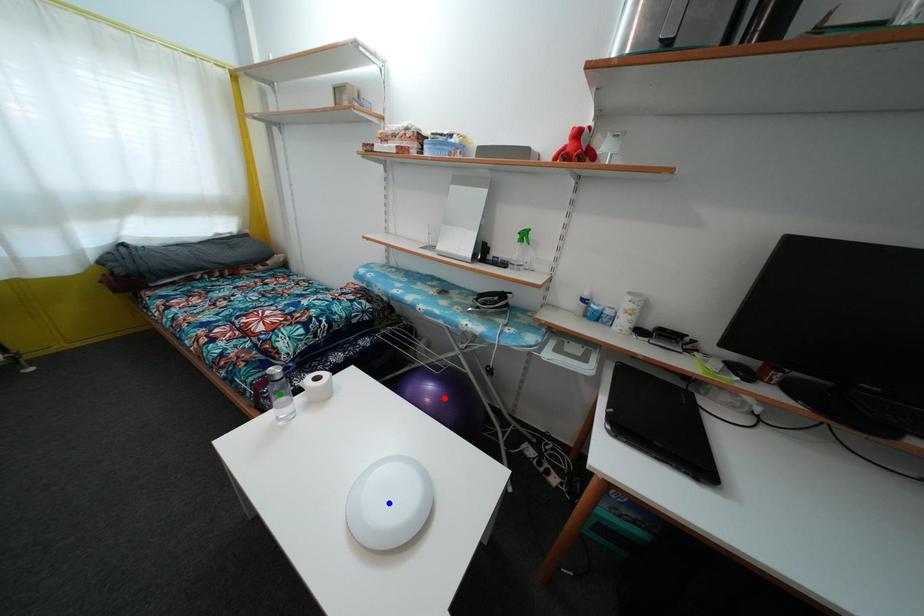
Order these from nearest to farthest:
A) blue point
B) red point
C) green point

blue point, green point, red point